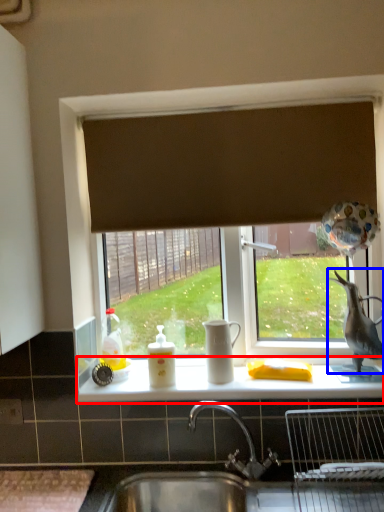
Question: Which of the following is the closest to the observer, counter top (highlighted by a red box) or animal (highlighted by a blue box)?

Choices:
 (A) counter top
 (B) animal

Answer: (A)